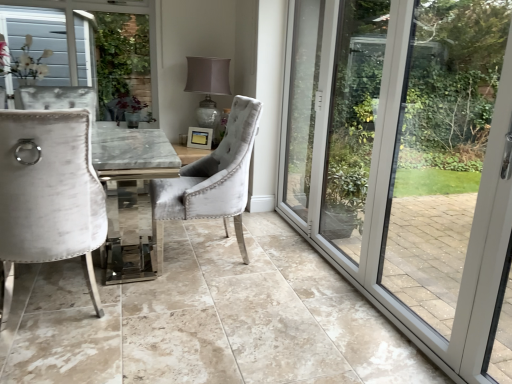
Find the location of a particular element. The height and width of the screenshot is (384, 512). free region under velvet white chair at left, acting as the second chair starting from the right (from a real-world perspective) is located at coordinates (52, 302).